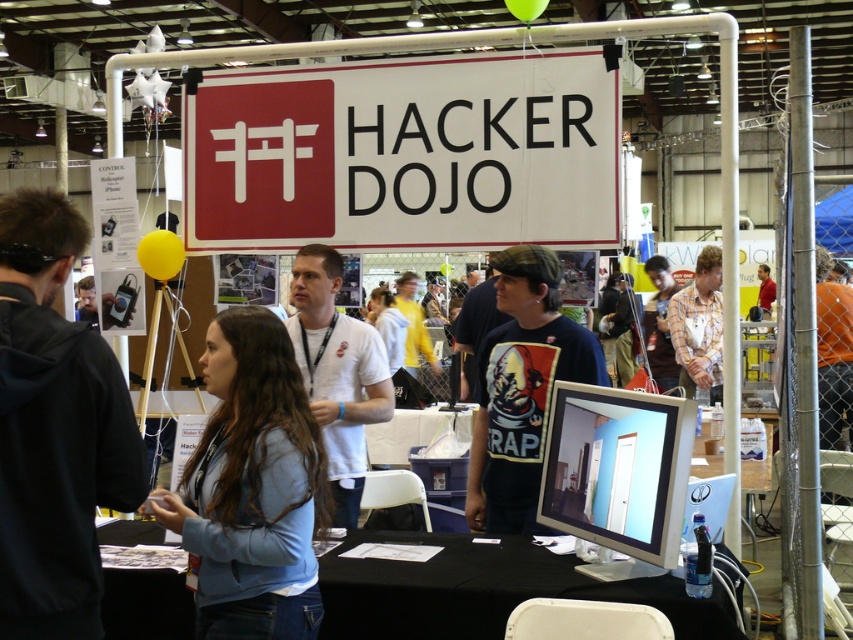
Who is positioned more to the right, dark blue t-shirt at center or plaid shirt at center?

From the viewer's perspective, plaid shirt at center appears more on the right side.

Does dark blue t-shirt at center come in front of plaid shirt at center?

Yes, dark blue t-shirt at center is closer to the viewer.

This screenshot has width=853, height=640. What do you see at coordinates (521, 388) in the screenshot?
I see `dark blue t-shirt at center` at bounding box center [521, 388].

Find the location of a particular element. Image resolution: width=853 pixels, height=640 pixels. dark blue t-shirt at center is located at coordinates (521, 388).

Who is shorter, dark blue hoodie at left or plaid shirt at center?

dark blue hoodie at left is shorter.

How distant is dark blue hoodie at left from plaid shirt at center?

They are 5.03 meters apart.

Identify the location of dark blue hoodie at left. This screenshot has width=853, height=640. (55, 429).

Does point (239, 208) lie in front of point (837, 404)?

That is True.

Who is taller, white paper sign at upper center or orange shirt at center?

orange shirt at center

Is point (457, 141) in front of point (819, 284)?

Yes.

You are a GUI agent. You are given a task and a screenshot of the screen. Output one action in this format:
    pyautogui.click(x=<x>, y=<y>)
    Task: Click on the white paper sign at upper center
    The width and height of the screenshot is (853, 640).
    Given the screenshot: What is the action you would take?
    pyautogui.click(x=405, y=154)